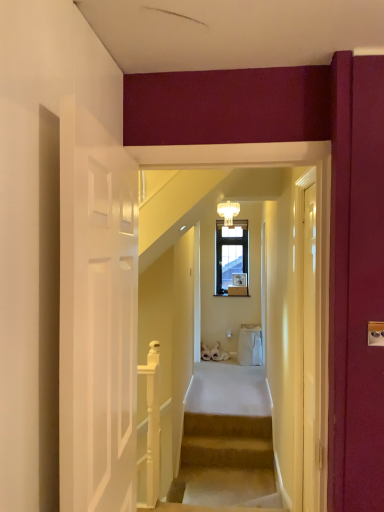
This screenshot has height=512, width=384. I want to click on translucent glass chandelier at upper center, so click(x=228, y=211).

Choose the correct answer: Is clear glass door at right inside white glossy wooden handrail at lower left or outside it?

clear glass door at right is not enclosed by white glossy wooden handrail at lower left.

Identify the location of rail on the left side of clear glass door at right. The width and height of the screenshot is (384, 512). (151, 426).

Considering the relative positions of clear glass door at right and white glossy wooden handrail at lower left in the image provided, is clear glass door at right to the left of white glossy wooden handrail at lower left from the viewer's perspective?

In fact, clear glass door at right is to the right of white glossy wooden handrail at lower left.

Is point (316, 361) closer to camera compared to point (158, 476)?

Yes, point (316, 361) is closer to viewer.

Could you tell me if white glossy wooden handrail at lower left is facing translucent glass chandelier at upper center?

No, white glossy wooden handrail at lower left is not facing towards translucent glass chandelier at upper center.

Are white glossy wooden handrail at lower left and translucent glass chandelier at upper center far apart?

white glossy wooden handrail at lower left is far away from translucent glass chandelier at upper center.

Considering the relative sizes of white glossy wooden handrail at lower left and translucent glass chandelier at upper center in the image provided, is white glossy wooden handrail at lower left wider than translucent glass chandelier at upper center?

No, white glossy wooden handrail at lower left is not wider than translucent glass chandelier at upper center.

Could you tell me if translucent glass chandelier at upper center is turned towards clear glass door at right?

Yes, translucent glass chandelier at upper center is facing clear glass door at right.

Is translucent glass chandelier at upper center bigger or smaller than clear glass door at right?

Clearly, translucent glass chandelier at upper center is smaller in size than clear glass door at right.

Where is `light fixture above the clear glass door at right (from a real-world perspective)`? light fixture above the clear glass door at right (from a real-world perspective) is located at coordinates (228, 211).

Can clear glass door at right be found inside translucent glass chandelier at upper center?

No, clear glass door at right is not inside translucent glass chandelier at upper center.

In terms of height, does white glossy wooden handrail at lower left look taller or shorter compared to clear glass door at right?

white glossy wooden handrail at lower left is shorter than clear glass door at right.

Could you tell me if white glossy wooden handrail at lower left is facing clear glass door at right?

No, white glossy wooden handrail at lower left is not aimed at clear glass door at right.

Considering the positions of objects white glossy wooden handrail at lower left and clear glass door at right in the image provided, who is more to the left, white glossy wooden handrail at lower left or clear glass door at right?

white glossy wooden handrail at lower left.

Who is bigger, clear glass door at right or translucent glass chandelier at upper center?

clear glass door at right is bigger.

From the picture: Is translucent glass chandelier at upper center at the back of clear glass door at right?

No.

Is clear glass door at right positioned beyond the bounds of translucent glass chandelier at upper center?

Absolutely, clear glass door at right is external to translucent glass chandelier at upper center.

From a real-world perspective, relative to translucent glass chandelier at upper center, is clear glass door at right vertically above or below?

In terms of real-world spatial position, clear glass door at right is below translucent glass chandelier at upper center.

Does translucent glass chandelier at upper center have a lesser height compared to white glossy wooden handrail at lower left?

Yes, translucent glass chandelier at upper center is shorter than white glossy wooden handrail at lower left.

Is translucent glass chandelier at upper center at the right side of white glossy wooden handrail at lower left?

Yes.

Which is less distant, (x=229, y=205) or (x=154, y=476)?

Point (x=229, y=205).

Can you tell me how much translucent glass chandelier at upper center and white glossy wooden handrail at lower left differ in facing direction?

They differ by 92.4 degrees in their facing directions.

The image size is (384, 512). Identify the location of rail that is on the left side of clear glass door at right. (151, 426).

Locate an element on the screen. The width and height of the screenshot is (384, 512). rail below the translucent glass chandelier at upper center (from a real-world perspective) is located at coordinates (151, 426).

From the picture: From the image, which object appears to be nearer to translucent glass chandelier at upper center, white glossy wooden handrail at lower left or clear glass door at right?

Among the two, white glossy wooden handrail at lower left is located nearer to translucent glass chandelier at upper center.

When comparing their distances from clear glass door at right, does translucent glass chandelier at upper center or white glossy wooden handrail at lower left seem further?

translucent glass chandelier at upper center is positioned further to the anchor clear glass door at right.

From the image, which object appears to be farther from translucent glass chandelier at upper center, clear glass door at right or white glossy wooden handrail at lower left?

Among the two, clear glass door at right is located further to translucent glass chandelier at upper center.

From the image, which object appears to be farther from white glossy wooden handrail at lower left, translucent glass chandelier at upper center or clear glass door at right?

Based on the image, translucent glass chandelier at upper center appears to be further to white glossy wooden handrail at lower left.

Considering their positions, is white glossy wooden handrail at lower left positioned further to clear glass door at right than translucent glass chandelier at upper center?

Based on the image, translucent glass chandelier at upper center appears to be further to clear glass door at right.

From the image, which object appears to be nearer to white glossy wooden handrail at lower left, clear glass door at right or translucent glass chandelier at upper center?

Based on the image, clear glass door at right appears to be nearer to white glossy wooden handrail at lower left.

This screenshot has height=512, width=384. Find the location of `rail positioned between clear glass door at right and translucent glass chandelier at upper center from near to far`. rail positioned between clear glass door at right and translucent glass chandelier at upper center from near to far is located at coordinates (151, 426).